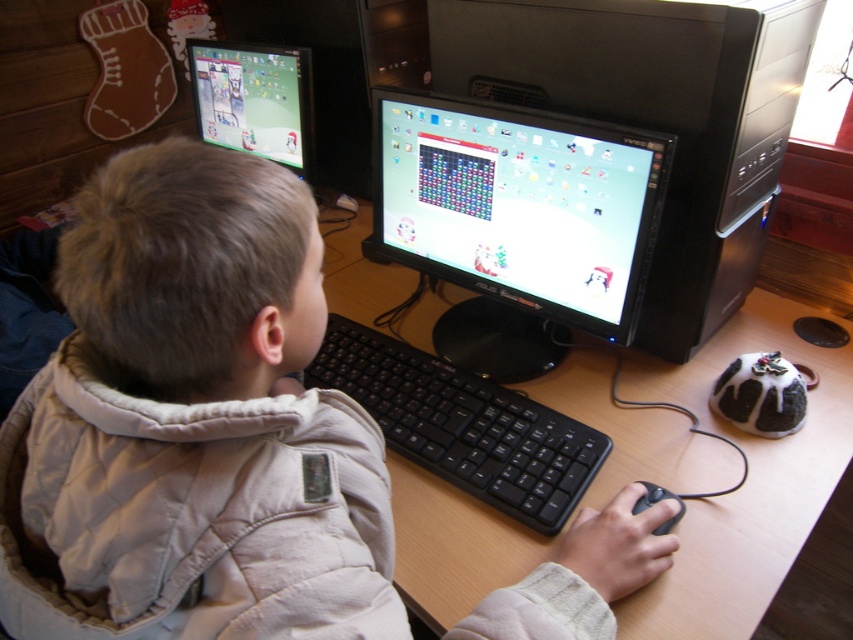
You are a delivery robot trying to place a package on the desk. The package must be placed where it won t interfere with the matte black monitor at center or the black matte mouse at lower right. Based on their positions, where should you place the package?

The matte black monitor at center is above the black matte mouse at lower right, so placing the package to the left or right of the black matte mouse at lower right would avoid interfering with both objects.

You are a delivery robot with a 12 inch wide package. You need to place it on the desk between the matte black monitor at center and the black matte mouse at lower right. Is there enough space?

The distance between the matte black monitor at center and the black matte mouse at lower right is 17.52 inches. Since the package is 12 inches wide, there is sufficient space to place it between them.

You are a delivery person who needs to place a package on the desk. The package is 20 cm tall and must be placed between the two monitors. The black plastic monitor at center is closer to you than the matte black monitor at center. Can you fit the package between them vertically?

The black plastic monitor at center is closer to the viewer than matte black monitor at center, so the vertical space between them may vary. However, since the package is only 20 cm tall, it should fit vertically between the two monitors as long as the height difference isn